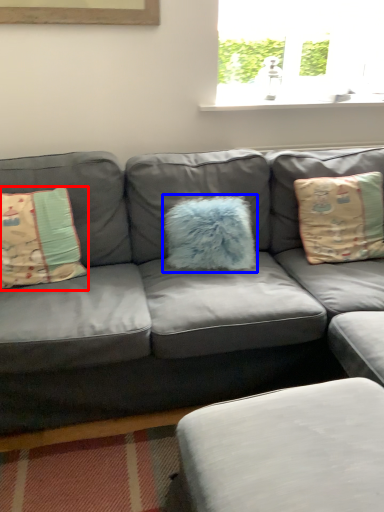
Question: Which object is closer to the camera taking this photo, pillow (highlighted by a red box) or pillow (highlighted by a blue box)?

Choices:
 (A) pillow
 (B) pillow

Answer: (A)